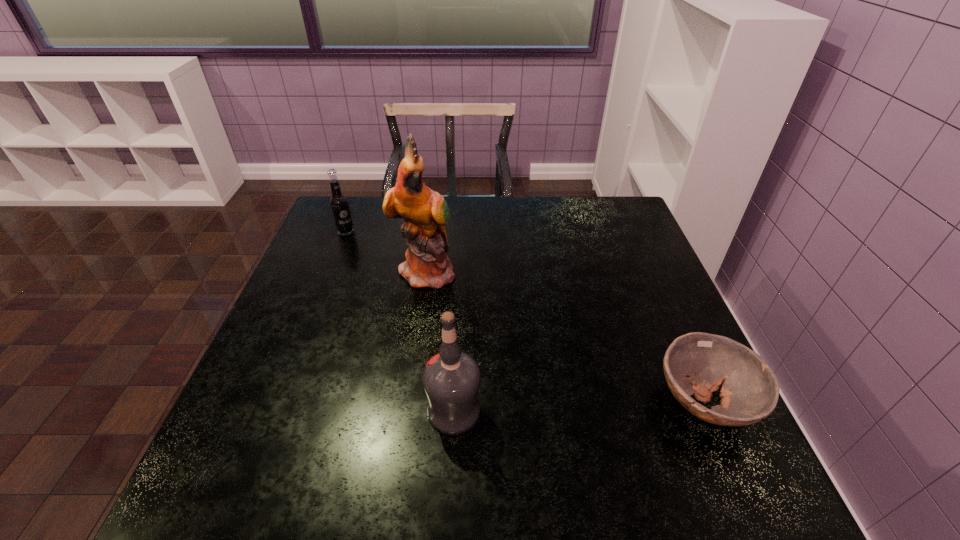
Point out which object is positioned as the nearest to the bowl. Please provide its 2D coordinates. Your answer should be formatted as a tuple, i.e. [(x, y)], where the tuple contains the x and y coordinates of a point satisfying the conditions above.

[(451, 379)]

Select which object appears as the third closest to the second farthest object. Please provide its 2D coordinates. Your answer should be formatted as a tuple, i.e. [(x, y)], where the tuple contains the x and y coordinates of a point satisfying the conditions above.

[(697, 363)]

Find the location of a particular element. vacant area that satisfies the following two spatial constraints: 1. on the front side of the vodka; 2. on the front label of the third tallest object is located at coordinates (275, 411).

Locate an element on the screen. free spot that satisfies the following two spatial constraints: 1. on the front side of the parrot; 2. on the right side of the leftmost object is located at coordinates (330, 271).